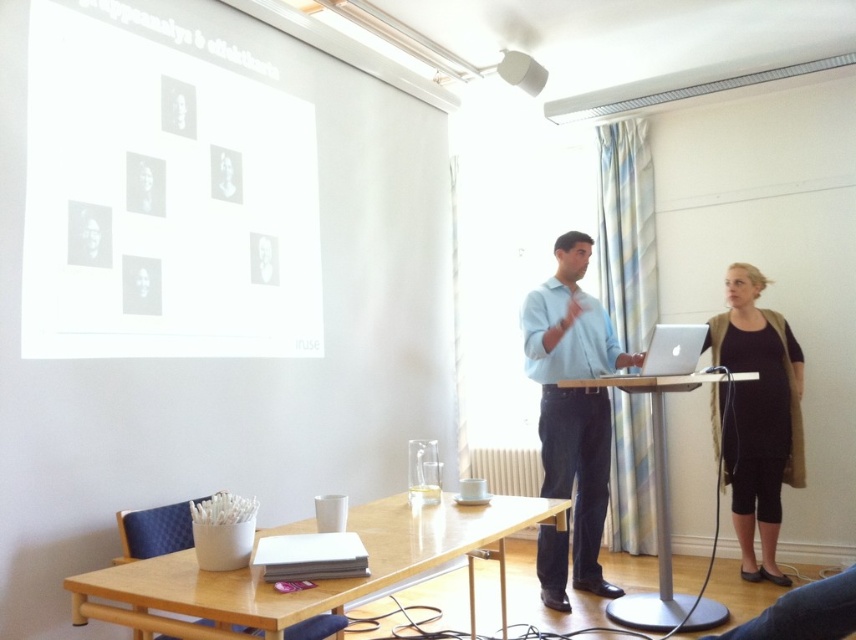
Question: Which object is the farthest from the black jersey at right?

Choices:
 (A) matte black portrait at upper left
 (B) wooden table at center

Answer: (A)

Question: Can you confirm if gray matte portraits at upper left is bigger than smooth skin portrait at upper left?

Choices:
 (A) no
 (B) yes

Answer: (B)

Question: Among these objects, which one is farthest from the camera?

Choices:
 (A) smooth skin portrait at upper left
 (B) light wood table at center

Answer: (A)

Question: Considering the real-world distances, which object is farthest from the black jersey at right?

Choices:
 (A) white paper at upper center
 (B) silver metallic laptop at center
 (C) matte white cylindrical at upper center
 (D) wooden table at center

Answer: (A)

Question: Is smooth skin portrait at upper left thinner than matte white cylindrical at upper center?

Choices:
 (A) yes
 (B) no

Answer: (A)

Question: Is silver metallic laptop at center smaller than matte white cylindrical at upper center?

Choices:
 (A) yes
 (B) no

Answer: (B)